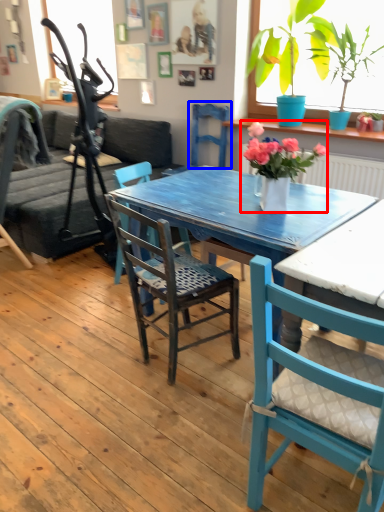
Question: Which object appears closest to the camera in this image, houseplant (highlighted by a red box) or armchair (highlighted by a blue box)?

Choices:
 (A) houseplant
 (B) armchair

Answer: (A)